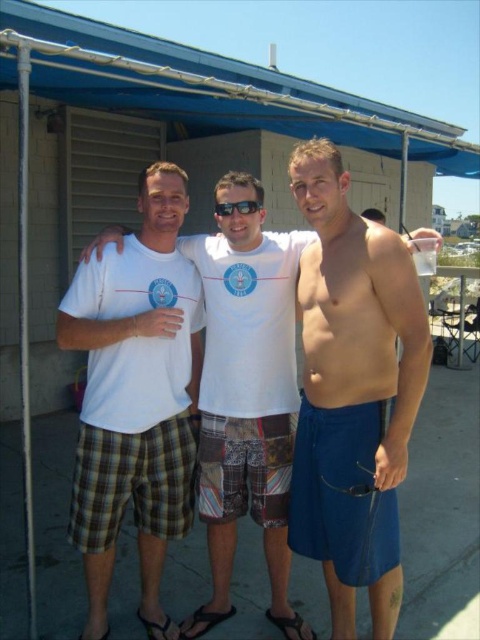
Question: In this image, where is blue fabric shorts at center located relative to blue fabric canopy at upper center?

Choices:
 (A) right
 (B) left

Answer: (A)

Question: Which point is closer to the camera taking this photo?

Choices:
 (A) (97, 460)
 (B) (108, 44)
 (C) (215, 211)
 (D) (156, 184)

Answer: (A)

Question: Can you confirm if blue fabric shorts at center is bigger than black plastic goggles at center?

Choices:
 (A) yes
 (B) no

Answer: (A)

Question: Among these objects, which one is nearest to the camera?

Choices:
 (A) blue fabric shorts at center
 (B) white cotton t-shirt at center
 (C) black plastic goggles at center
 (D) plaid shorts at left

Answer: (A)

Question: Among these objects, which one is nearest to the camera?

Choices:
 (A) white cotton t-shirt at center
 (B) plaid shorts at left
 (C) blue fabric shorts at center

Answer: (C)

Question: Can you confirm if plaid shorts at left is wider than black plastic goggles at center?

Choices:
 (A) no
 (B) yes

Answer: (B)